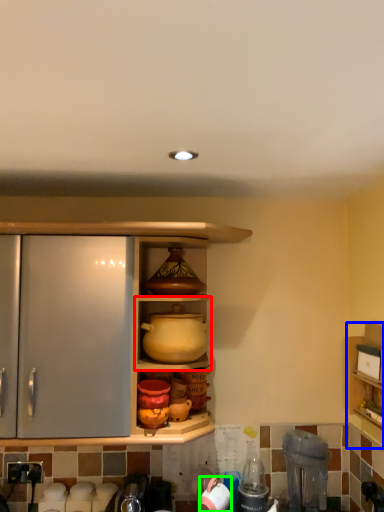
Question: Based on their relative distances, which object is nearer to shelf (highlighted by a red box)? Choose from shelf (highlighted by a blue box) and appliance (highlighted by a green box).

Choices:
 (A) shelf
 (B) appliance

Answer: (B)